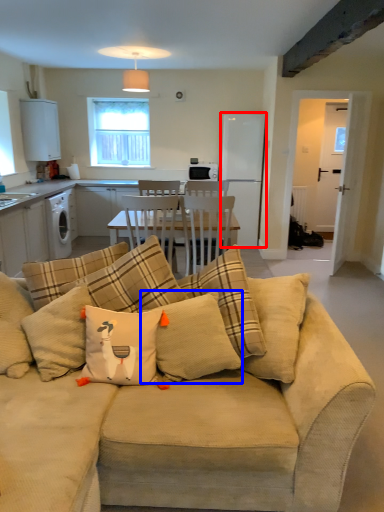
Question: Which object is closer to the camera taking this photo, appliance (highlighted by a red box) or pillow (highlighted by a blue box)?

Choices:
 (A) appliance
 (B) pillow

Answer: (B)